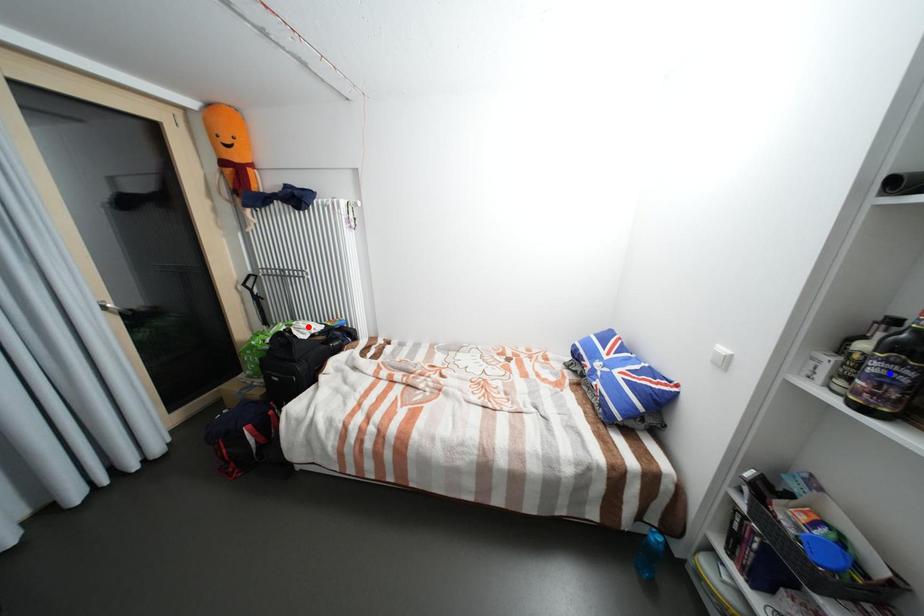
Question: Which of the two points in the image is closer to the camera?

Choices:
 (A) Blue point is closer.
 (B) Red point is closer.

Answer: (A)